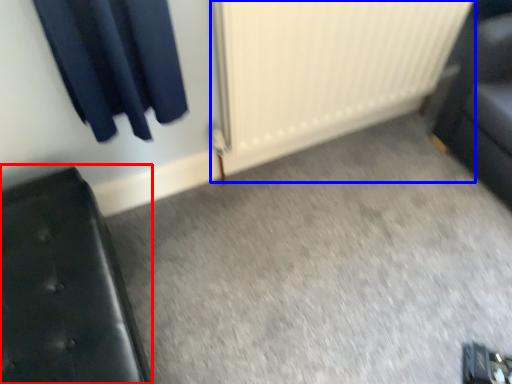
Question: Which point is closer to the camera, furniture (highlighted by a red box) or radiator (highlighted by a blue box)?

Choices:
 (A) furniture
 (B) radiator

Answer: (A)